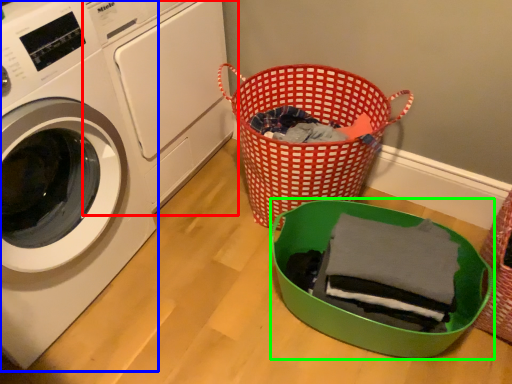
Question: Estimate the real-world distances between objects in this image. Which object is farther from washing machine (highlighted by a red box), washing machine (highlighted by a blue box) or basket (highlighted by a green box)?

Choices:
 (A) washing machine
 (B) basket

Answer: (B)